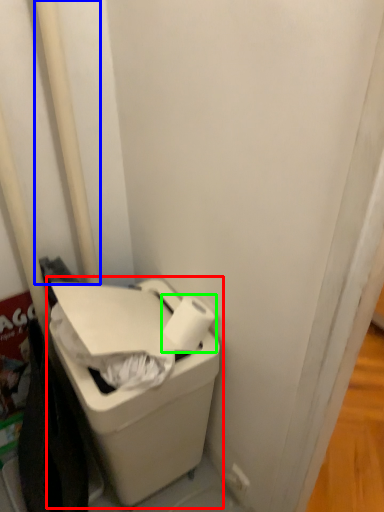
Question: Considering the real-world distances, which object is farthest from waste container (highlighted by a red box)? pole (highlighted by a blue box) or toilet paper (highlighted by a green box)?

Choices:
 (A) pole
 (B) toilet paper

Answer: (A)